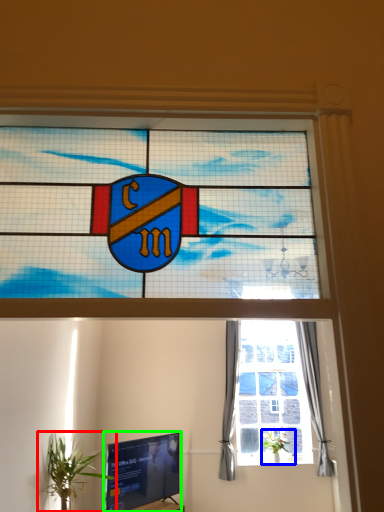
Question: Based on their relative distances, which object is farther from houseplant (highlighted by a red box)? Choose from houseplant (highlighted by a blue box) and television (highlighted by a green box).

Choices:
 (A) houseplant
 (B) television

Answer: (A)